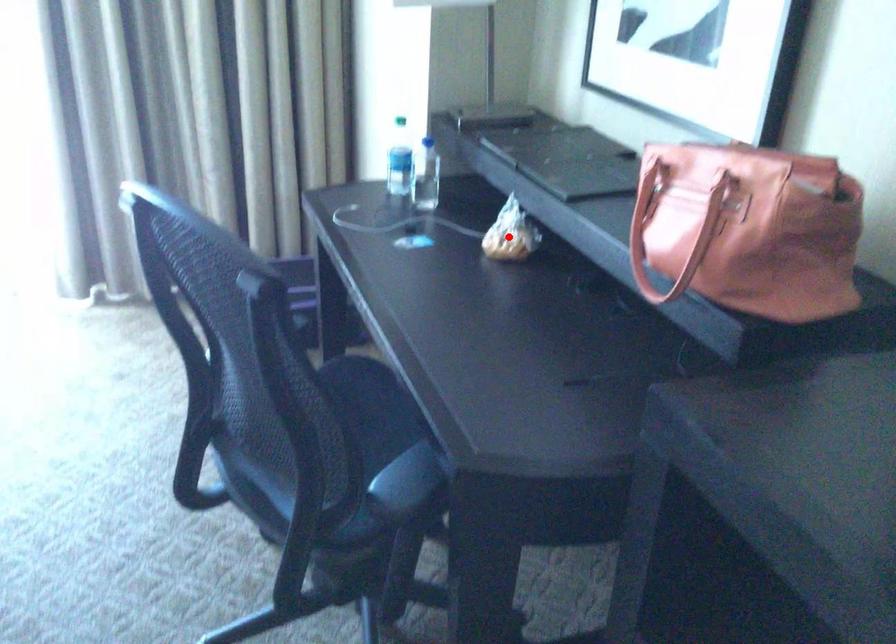
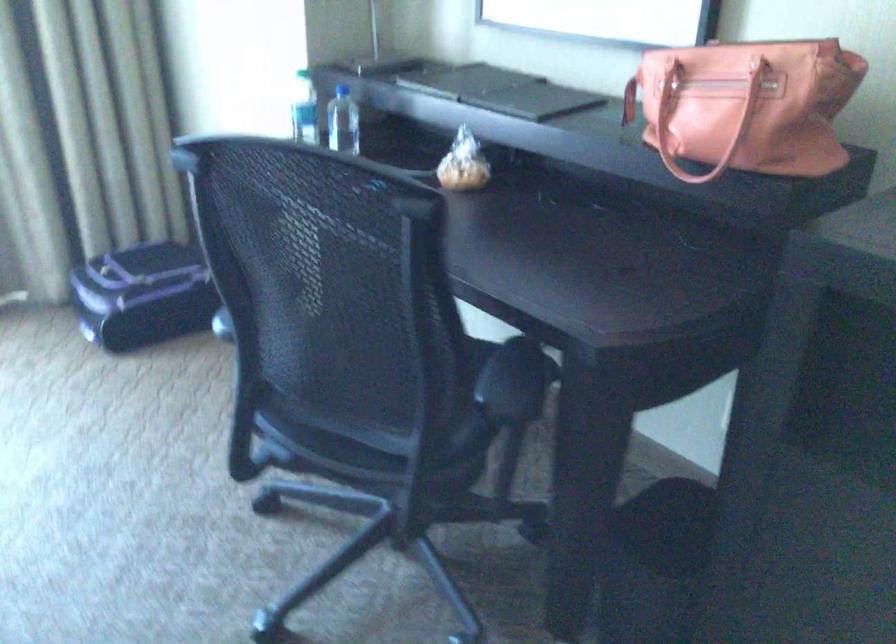
Where in the second image is the point corresponding to the highlighted location from the first image?

(462, 164)